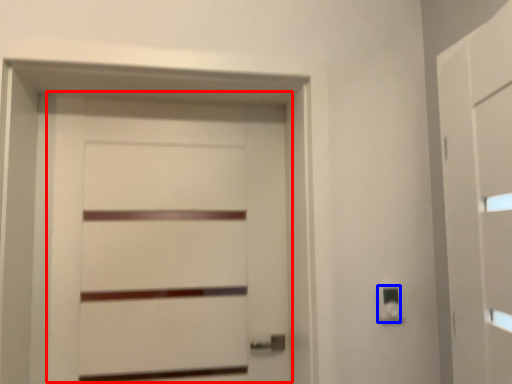
Question: Among these objects, which one is farthest to the camera, door (highlighted by a red box) or light switch (highlighted by a blue box)?

Choices:
 (A) door
 (B) light switch

Answer: (A)